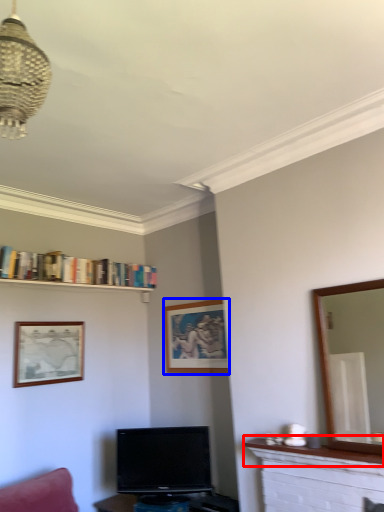
Question: Among these objects, which one is nearest to the camera, mantle (highlighted by a red box) or picture frame (highlighted by a blue box)?

Choices:
 (A) mantle
 (B) picture frame

Answer: (A)